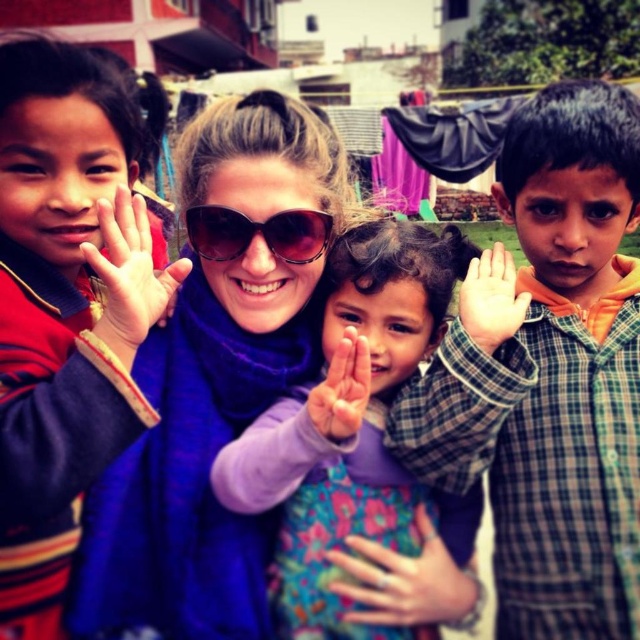
Between point (161, 292) and point (333, 369), which one is positioned behind?

Positioned behind is point (161, 292).

You are a GUI agent. You are given a task and a screenshot of the screen. Output one action in this format:
    pyautogui.click(x=<x>, y=<y>)
    Task: Click on the matte purple scarf at center
    Image resolution: width=640 pixels, height=640 pixels.
    Given the screenshot: What is the action you would take?
    pyautogui.click(x=129, y=273)

Can you confirm if purple scarf at center is positioned to the left of red plaid shirt at left?

Incorrect, purple scarf at center is not on the left side of red plaid shirt at left.

Is purple scarf at center behind red plaid shirt at left?

Yes, it is behind red plaid shirt at left.

Who is more distant from viewer, (132, 540) or (6, 106)?

Point (132, 540)

Find the location of `purple scarf at center`. purple scarf at center is located at coordinates (196, 458).

Does checkered fabric shirt at right lie behind purple scarf at center?

Yes, it is behind purple scarf at center.

Does checkered fabric shirt at right have a lesser height compared to purple scarf at center?

No.

The height and width of the screenshot is (640, 640). What are the coordinates of `checkered fabric shirt at right` in the screenshot? It's located at (548, 374).

Locate an element on the screen. checkered fabric shirt at right is located at coordinates (548, 374).